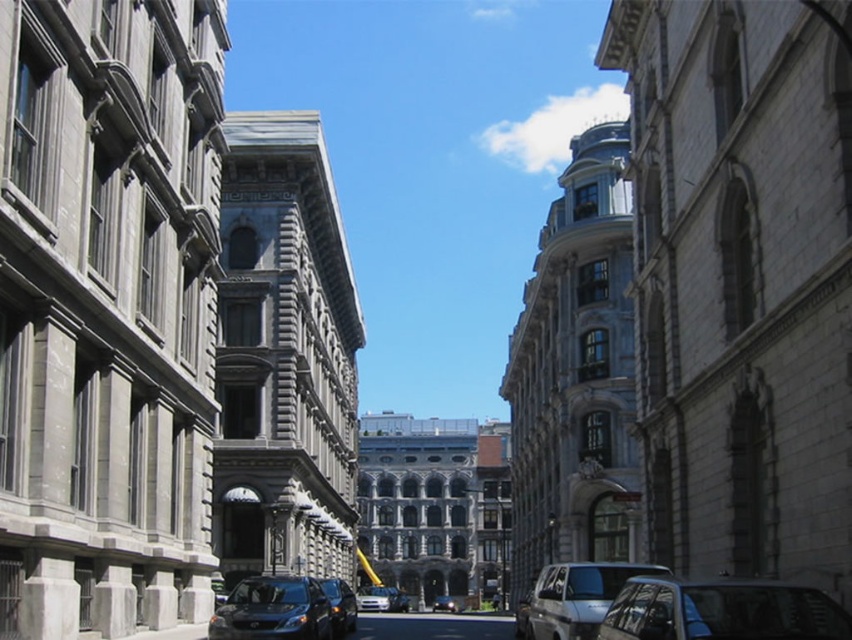
Is silver metallic van at center above white glossy car at center?

Yes, silver metallic van at center is above white glossy car at center.

Does silver metallic van at center have a lesser width compared to white glossy car at center?

In fact, silver metallic van at center might be wider than white glossy car at center.

Between point (554, 593) and point (360, 600), which one is positioned behind?

The point (360, 600) is behind.

The height and width of the screenshot is (640, 852). I want to click on silver metallic van at center, so click(x=574, y=596).

This screenshot has width=852, height=640. I want to click on silver metallic van at center, so click(x=574, y=596).

Is silver metallic van at center closer to the viewer compared to shiny black van at center?

Yes.

Find the location of a particular element. silver metallic van at center is located at coordinates (x=574, y=596).

You are a GUI agent. You are given a task and a screenshot of the screen. Output one action in this format:
    pyautogui.click(x=<x>, y=<y>)
    Task: Click on the silver metallic van at center
    The width and height of the screenshot is (852, 640).
    Given the screenshot: What is the action you would take?
    pyautogui.click(x=574, y=596)

Which is behind, point (371, 602) or point (453, 611)?

The point (453, 611) is behind.

Who is positioned more to the left, white glossy car at center or shiny black car at center?

Positioned to the left is white glossy car at center.

Between point (404, 595) and point (435, 604), which one is positioned in front?

Point (404, 595)

Locate an element on the screen. white glossy car at center is located at coordinates (381, 600).